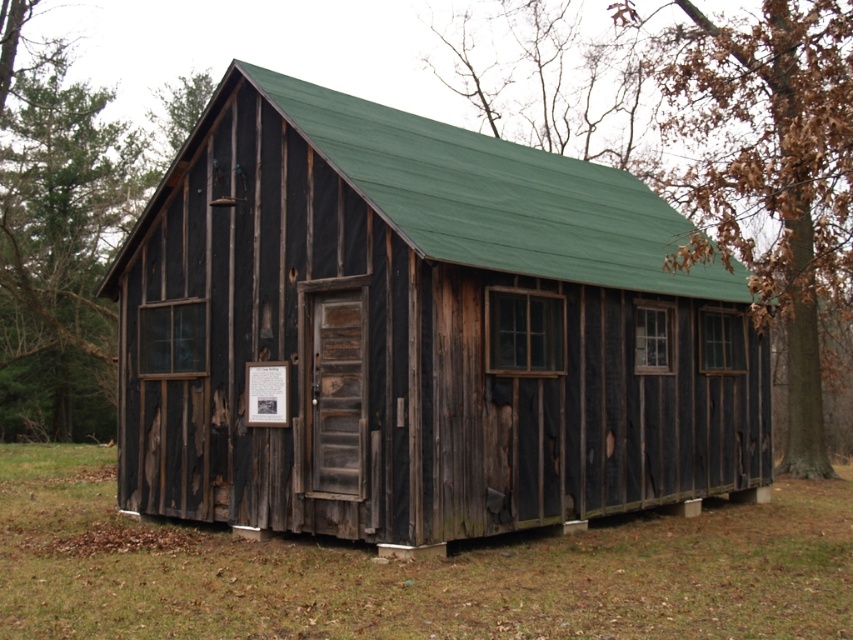
Can you confirm if black weathered wood cabin at center is positioned below green rough bark tree at upper left?

Yes, black weathered wood cabin at center is below green rough bark tree at upper left.

Is black weathered wood cabin at center to the left of green rough bark tree at upper left from the viewer's perspective?

Incorrect, black weathered wood cabin at center is not on the left side of green rough bark tree at upper left.

Describe the element at coordinates (416, 332) in the screenshot. I see `black weathered wood cabin at center` at that location.

You are a GUI agent. You are given a task and a screenshot of the screen. Output one action in this format:
    pyautogui.click(x=<x>, y=<y>)
    Task: Click on the black weathered wood cabin at center
    Image resolution: width=853 pixels, height=640 pixels.
    Given the screenshot: What is the action you would take?
    pyautogui.click(x=416, y=332)

Can you confirm if brown leafy tree at right is bigger than green rough bark tree at upper left?

Yes, brown leafy tree at right is bigger than green rough bark tree at upper left.

Does brown leafy tree at right appear on the left side of green rough bark tree at upper left?

Incorrect, brown leafy tree at right is not on the left side of green rough bark tree at upper left.

Which is behind, point (744, 132) or point (38, 344)?

The point (38, 344) is behind.

Where is `brown leafy tree at right`? The height and width of the screenshot is (640, 853). brown leafy tree at right is located at coordinates (769, 173).

Is black weathered wood cabin at center closer to the viewer compared to brown leafy tree at right?

No.

Between black weathered wood cabin at center and brown leafy tree at right, which one is positioned higher?

brown leafy tree at right is higher up.

Where is `black weathered wood cabin at center`? black weathered wood cabin at center is located at coordinates (416, 332).